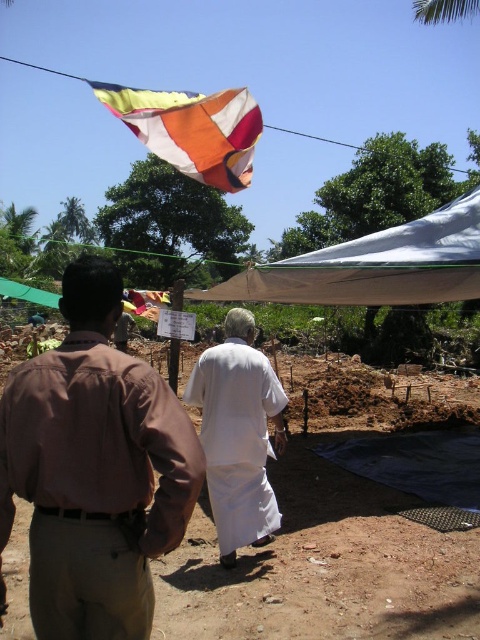
Between brown cotton shirt at center and tan canvas tent at center, which one has more height?

Standing taller between the two is brown cotton shirt at center.

Does brown cotton shirt at center have a greater width compared to tan canvas tent at center?

Incorrect, brown cotton shirt at center's width does not surpass tan canvas tent at center's.

Does point (75, 451) come behind point (436, 291)?

No, it is not.

You are a GUI agent. You are given a task and a screenshot of the screen. Output one action in this format:
    pyautogui.click(x=<x>, y=<y>)
    Task: Click on the brown cotton shirt at center
    The width and height of the screenshot is (480, 640).
    Given the screenshot: What is the action you would take?
    pyautogui.click(x=95, y=468)

Is point (457, 209) more distant than point (116, 84)?

That is False.

Who is shorter, tan canvas tent at center or multi-colored fabric flag at upper center?

Standing shorter between the two is tan canvas tent at center.

Which is behind, point (208, 300) or point (227, 106)?

The point (208, 300) is behind.

I want to click on tan canvas tent at center, so click(x=373, y=266).

Who is shorter, brown soil at center or tan canvas tent at center?

Standing shorter between the two is brown soil at center.

Measure the distance between point (310, 445) and camera.

Point (310, 445) and camera are 7.83 meters apart.

Does point (168, 634) come behind point (415, 291)?

No, (168, 634) is in front of (415, 291).

Image resolution: width=480 pixels, height=640 pixels. In order to click on brown soil at center in this screenshot , I will do [x=325, y=557].